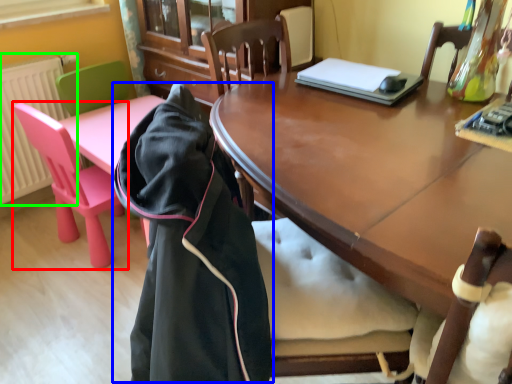
Question: Based on their relative distances, which object is farther from chair (highlighted by a red box)? Choose from cloak (highlighted by a blue box) and radiator (highlighted by a green box).

Choices:
 (A) cloak
 (B) radiator

Answer: (A)